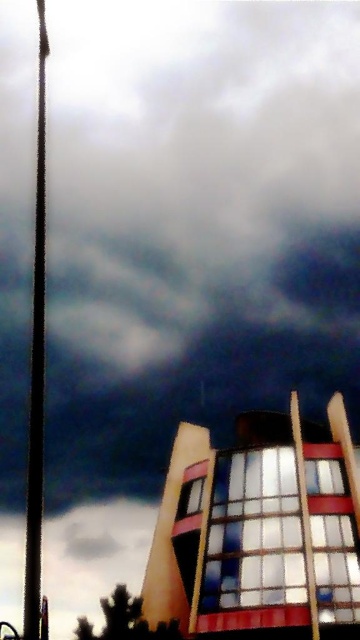
You are standing in front of the modern building with the metallic pole at left and wooden flag pole at right. Which pole is closer to you?

The metallic pole at left is closer to you because it is positioned over the wooden flag pole at right, indicating it is in front.

You are a city planner assessing the safety of the two poles in the image. Given that the metallic pole at left is taller than the wooden flag pole at right, which pole might pose a higher risk during a storm and why?

The metallic pole at left is taller than the wooden flag pole at right, so it might pose a higher risk during a storm because taller structures are more likely to be struck by lightning and could be more prone to wind damage due to their height.